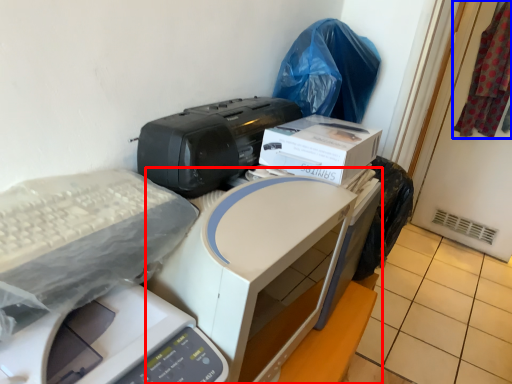
Question: Which object is further to the camera taking this photo, printer (highlighted by a red box) or material (highlighted by a blue box)?

Choices:
 (A) printer
 (B) material

Answer: (B)